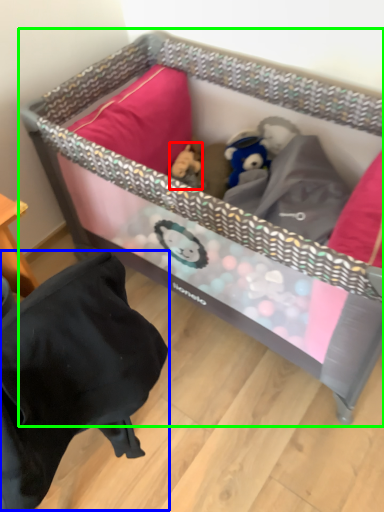
Question: Considering the real-world distances, which object is closest to toy (highlighted by a red box)? bean bag chair (highlighted by a blue box) or infant bed (highlighted by a green box).

Choices:
 (A) bean bag chair
 (B) infant bed

Answer: (B)